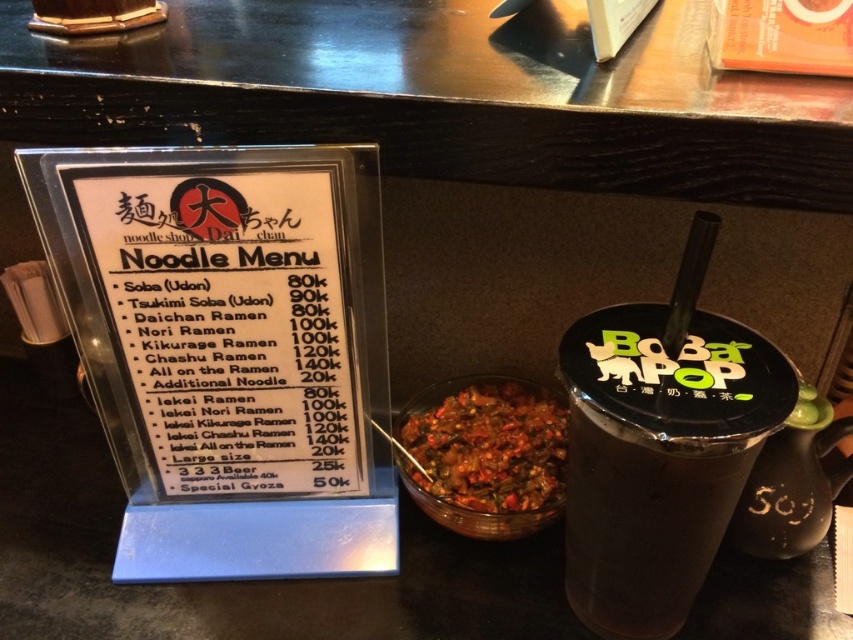
Is point (279, 371) less distant than point (456, 515)?

Yes.

Based on the photo, does white plastic menu at center have a greater width compared to chili pepper sauce at center?

Correct, the width of white plastic menu at center exceeds that of chili pepper sauce at center.

Measure the distance between white plastic menu at center and camera.

white plastic menu at center is 20.01 inches from camera.

Find the location of a particular element. The width and height of the screenshot is (853, 640). white plastic menu at center is located at coordinates (231, 326).

Does dark brown smooth cup at right appear on the right side of chili pepper sauce at center?

Yes, dark brown smooth cup at right is to the right of chili pepper sauce at center.

Is point (616, 317) farther from camera compared to point (428, 426)?

No, it is not.

What are the coordinates of `dark brown smooth cup at right` in the screenshot? It's located at (659, 458).

Does white plastic menu at center appear under dark brown smooth cup at right?

No, white plastic menu at center is not below dark brown smooth cup at right.

Is white plastic menu at center wider than dark brown smooth cup at right?

Yes, white plastic menu at center is wider than dark brown smooth cup at right.

Find the location of `white plastic menu at center`. white plastic menu at center is located at coordinates (231, 326).

Locate an element on the screen. This screenshot has width=853, height=640. white plastic menu at center is located at coordinates (231, 326).